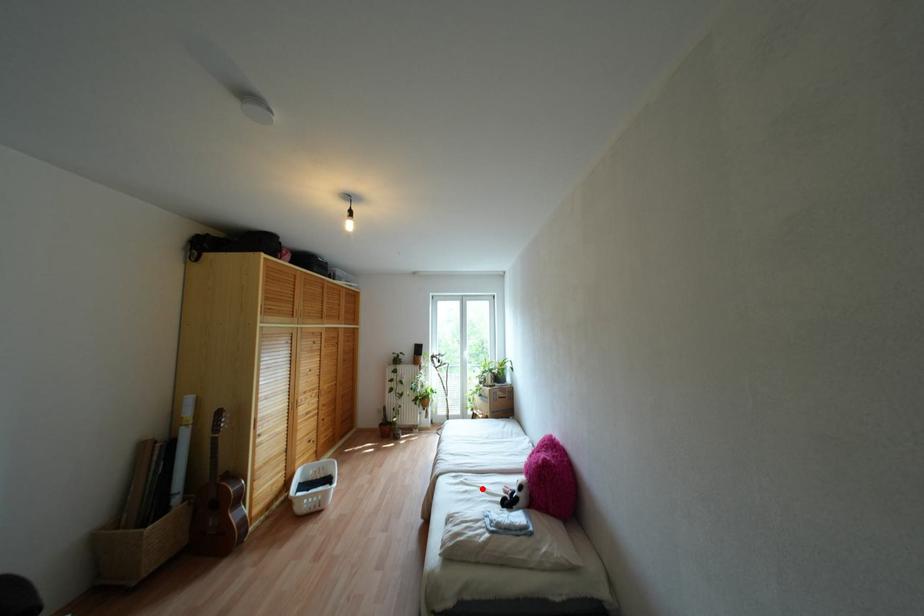
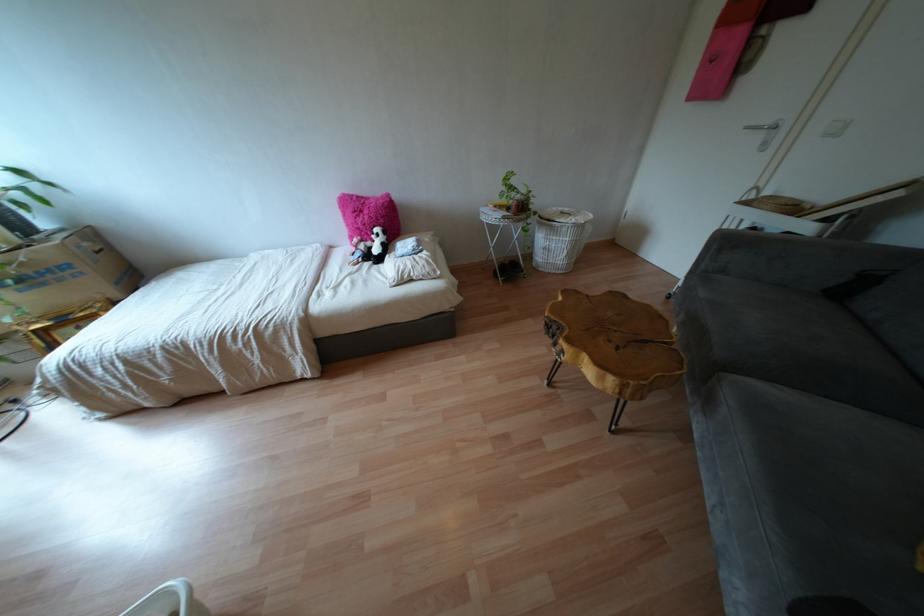
Locate, in the second image, the point that corresponds to the highlighted location in the first image.

(349, 274)